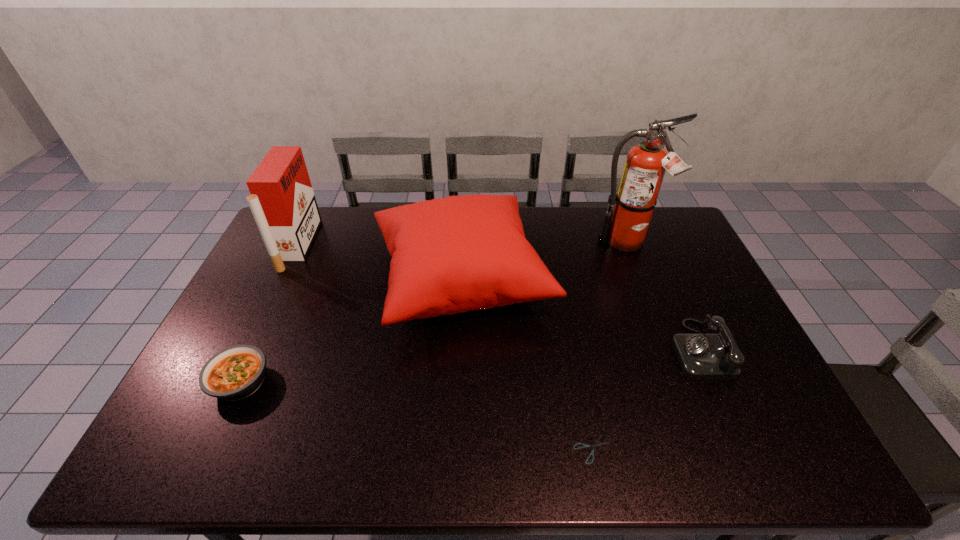
The width and height of the screenshot is (960, 540). Identify the location of free space that satisfies the following two spatial constraints: 1. on the front-facing side of the fifth shortest object; 2. on the left side of the stew. (233, 381).

This screenshot has height=540, width=960. Find the location of `free region that satisfies the following two spatial constraints: 1. on the front-facing side of the cigarette case; 2. on the back side of the second shortest object`. free region that satisfies the following two spatial constraints: 1. on the front-facing side of the cigarette case; 2. on the back side of the second shortest object is located at coordinates (233, 381).

Identify the location of vacant space that satisfies the following two spatial constraints: 1. on the front-facing side of the cushion; 2. on the right side of the cigarette case. Image resolution: width=960 pixels, height=540 pixels. (282, 278).

In order to click on vacant area that satisfies the following two spatial constraints: 1. from the nozzle of the tallest object; 2. on the front-facing side of the second tallest object in this screenshot , I will do `click(627, 245)`.

Find the location of a particular element. Image resolution: width=960 pixels, height=540 pixels. free space that satisfies the following two spatial constraints: 1. on the front-facing side of the cigarette case; 2. on the right side of the third tallest object is located at coordinates (282, 278).